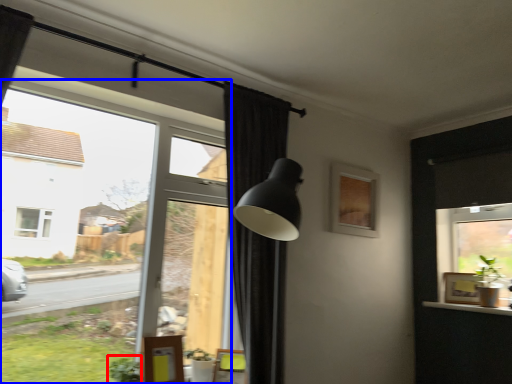
Question: Which object appears farthest to the camera in this image, plant (highlighted by a red box) or window (highlighted by a blue box)?

Choices:
 (A) plant
 (B) window

Answer: (A)